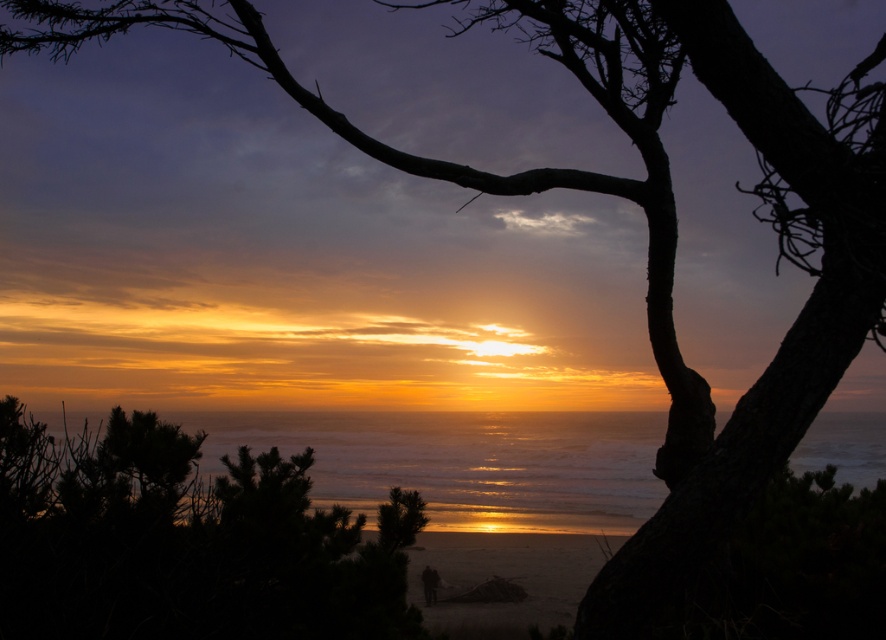
Is green leafy tree at center taller than shiny metallic water at center?

Correct, green leafy tree at center is much taller as shiny metallic water at center.

Which is in front, point (83, 548) or point (581, 433)?

Point (83, 548) is more forward.

Which is in front, point (37, 627) or point (525, 468)?

Point (37, 627)

The width and height of the screenshot is (886, 640). What are the coordinates of `green leafy tree at center` in the screenshot? It's located at (185, 541).